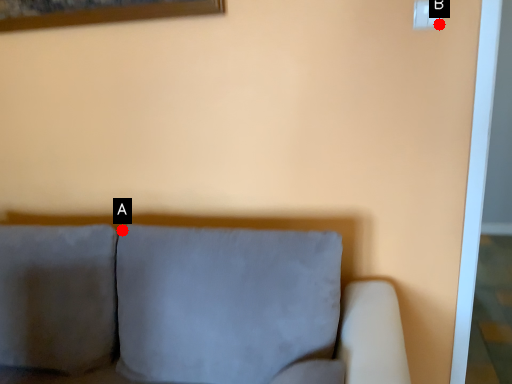
Question: Two points are circled on the image, labeled by A and B beside each circle. Among these points, which one is nearest to the camera?

Choices:
 (A) A is closer
 (B) B is closer

Answer: (B)